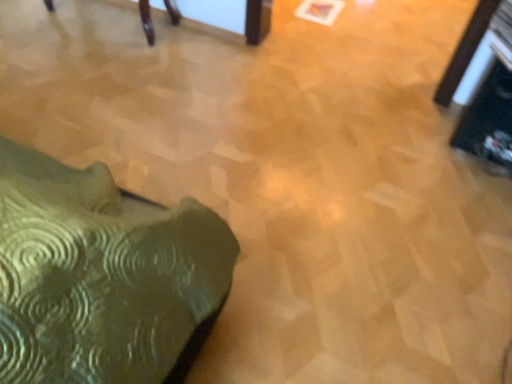
Identify the location of free space above wooden chair leg at upper center (from a real-world perspective). (193, 13).